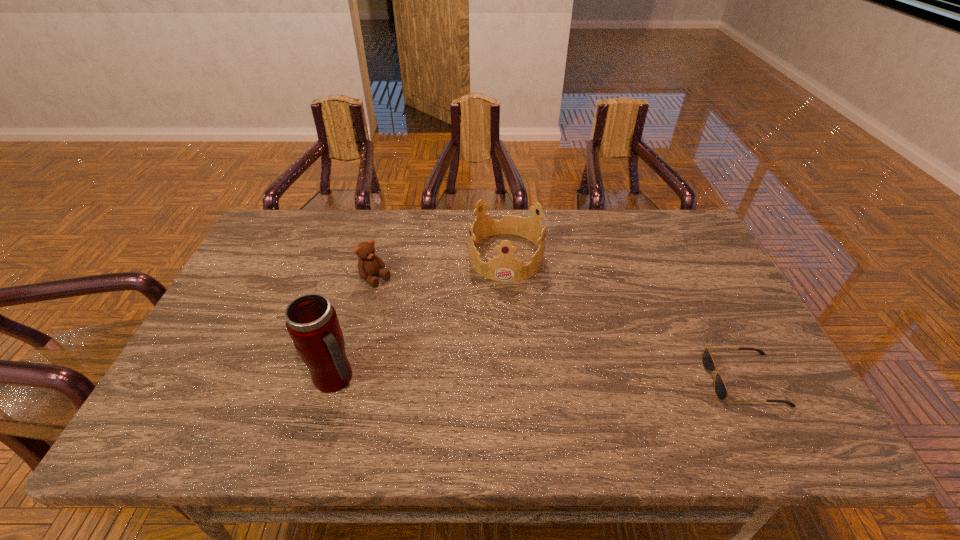
In order to click on free space located 0.100m on the face of the teddy bear in this screenshot , I will do `click(407, 304)`.

This screenshot has width=960, height=540. Identify the location of free location located on the face of the teddy bear. (396, 295).

I want to click on vacant region located 0.380m on the face of the teddy bear, so (480, 362).

Locate an element on the screen. This screenshot has width=960, height=540. vacant area situated on the front-facing side of the tiara is located at coordinates (500, 357).

Where is `free space located 0.070m on the front-facing side of the tiara`? free space located 0.070m on the front-facing side of the tiara is located at coordinates (504, 299).

This screenshot has height=540, width=960. I want to click on free region located 0.090m on the front-facing side of the tiara, so point(503,305).

This screenshot has width=960, height=540. Find the location of `object that is at the far edge`. object that is at the far edge is located at coordinates (504, 268).

Where is `thermos bottle located at the near edge`? thermos bottle located at the near edge is located at coordinates (312, 323).

Find the location of `sunglasses situated at the near edge`. sunglasses situated at the near edge is located at coordinates (708, 363).

Locate an element on the screen. The height and width of the screenshot is (540, 960). object that is at the right edge is located at coordinates (708, 363).